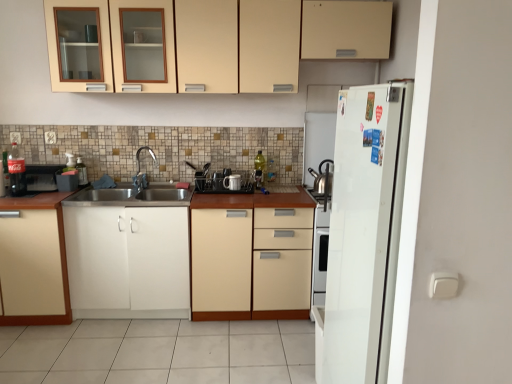
Question: Which direction should I rotate to look at matte cream cabinet at upper center, which is the second cabinetry in right-to-left order, — up or down?

Choices:
 (A) up
 (B) down

Answer: (A)

Question: Could white plastic electric outlet at upper left, which ranks as the first electric outlet in right-to-left order, be considered to be inside matte white cabinet at lower left, the 1th cabinetry in the left-to-right sequence?

Choices:
 (A) no
 (B) yes

Answer: (A)

Question: Is matte white cabinet at lower left, arranged as the 4th cabinetry when viewed from the right, facing towards white plastic electric outlet at upper left, which ranks as the first electric outlet in right-to-left order?

Choices:
 (A) no
 (B) yes

Answer: (A)

Question: From the image's perspective, is matte white cabinet at lower left, arranged as the 4th cabinetry when viewed from the right, on top of white plastic electric outlet at upper left, the second electric outlet from the left?

Choices:
 (A) yes
 (B) no

Answer: (B)

Question: Can you confirm if matte white cabinet at lower left, arranged as the 4th cabinetry when viewed from the right, is shorter than white plastic electric outlet at upper left, the second electric outlet from the left?

Choices:
 (A) no
 (B) yes

Answer: (A)

Question: Is matte white cabinet at lower left, arranged as the 4th cabinetry when viewed from the right, positioned in front of white plastic electric outlet at upper left, the second electric outlet from the left?

Choices:
 (A) yes
 (B) no

Answer: (A)

Question: Is matte white cabinet at lower left, arranged as the 4th cabinetry when viewed from the right, at the right side of white plastic electric outlet at upper left, the second electric outlet from the left?

Choices:
 (A) yes
 (B) no

Answer: (B)

Question: Is matte black dish rack at center, which is the 2th appliance from left to right, a part of metallic spray bottle at left, arranged as the first appliance when viewed from the left?

Choices:
 (A) no
 (B) yes

Answer: (A)

Question: From the image's perspective, would you say metallic spray bottle at left, the fourth appliance when ordered from right to left, is shown under matte black dish rack at center, marked as the third appliance in a right-to-left arrangement?

Choices:
 (A) yes
 (B) no

Answer: (B)

Question: Considering the relative sizes of metallic spray bottle at left, the fourth appliance when ordered from right to left, and matte black dish rack at center, marked as the third appliance in a right-to-left arrangement, in the image provided, is metallic spray bottle at left, the fourth appliance when ordered from right to left, wider than matte black dish rack at center, marked as the third appliance in a right-to-left arrangement,?

Choices:
 (A) no
 (B) yes

Answer: (A)

Question: Does metallic spray bottle at left, arranged as the first appliance when viewed from the left, have a greater height compared to matte black dish rack at center, marked as the third appliance in a right-to-left arrangement?

Choices:
 (A) yes
 (B) no

Answer: (A)

Question: Is metallic spray bottle at left, the fourth appliance when ordered from right to left, next to matte black dish rack at center, marked as the third appliance in a right-to-left arrangement?

Choices:
 (A) yes
 (B) no

Answer: (B)

Question: Is metallic spray bottle at left, arranged as the first appliance when viewed from the left, far from matte black dish rack at center, which is the 2th appliance from left to right?

Choices:
 (A) no
 (B) yes

Answer: (A)

Question: From a real-world perspective, is silver metallic tea pot at right under beige wood cabinet at center, marked as the fourth cabinetry in a left-to-right arrangement?

Choices:
 (A) no
 (B) yes

Answer: (A)